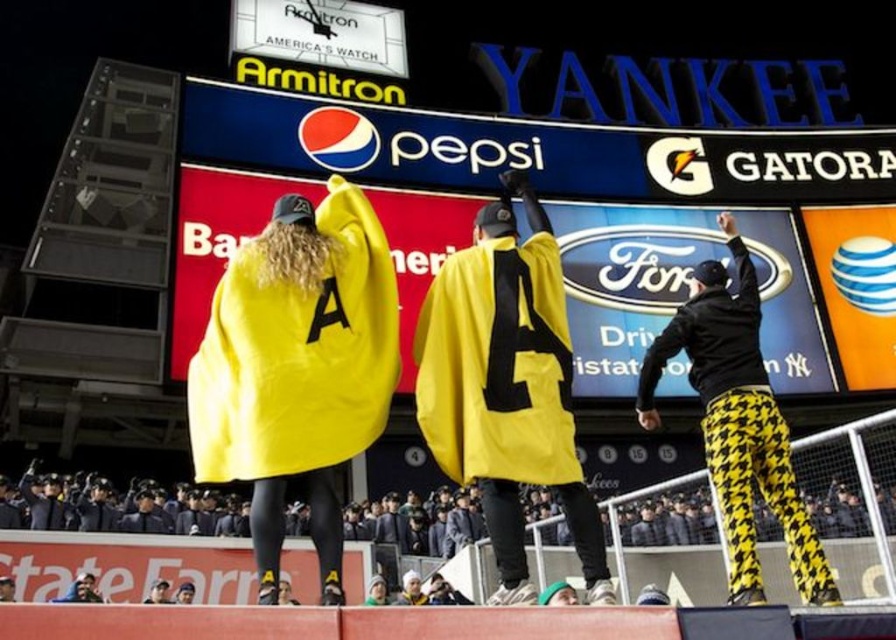
Who is more distant from viewer, [352,456] or [553,332]?

The point [553,332] is behind.

Who is more forward, (321, 243) or (528, 372)?

Point (528, 372) is more forward.

You are a GUI agent. You are given a task and a screenshot of the screen. Output one action in this format:
    pyautogui.click(x=<x>, y=<y>)
    Task: Click on the yellow fabric cape at center
    
    Given the screenshot: What is the action you would take?
    pyautogui.click(x=297, y=369)

Does yellow fabric cape at center have a lesser width compared to black houndstooth pants at right?

No, yellow fabric cape at center is not thinner than black houndstooth pants at right.

Identify the location of yellow fabric cape at center. This screenshot has height=640, width=896. (297, 369).

Where is `yellow fabric cape at center`? This screenshot has width=896, height=640. yellow fabric cape at center is located at coordinates (297, 369).

Is point (527, 259) in front of point (727, 304)?

Yes, it is.

Who is positioned more to the left, yellow matte cape at center or black houndstooth pants at right?

From the viewer's perspective, yellow matte cape at center appears more on the left side.

Is point (509, 460) farther from viewer compared to point (731, 323)?

That is False.

This screenshot has width=896, height=640. I want to click on yellow matte cape at center, so click(506, 387).